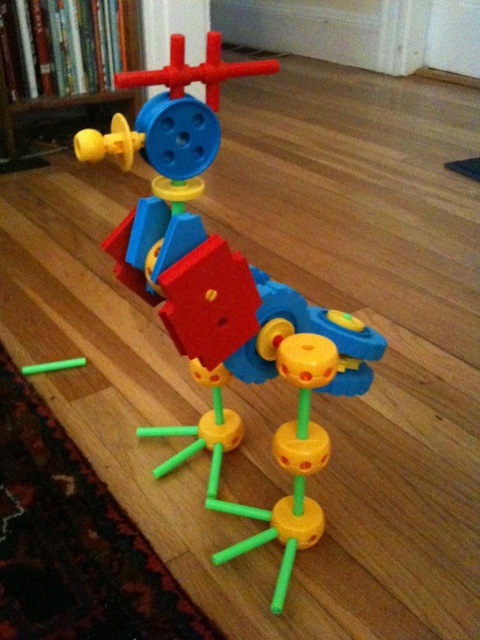
Question: Among these objects, which one is nearest to the camera?

Choices:
 (A) matte yellow plastic toy at upper left
 (B) matte plastic toy at center

Answer: (B)

Question: Observing the image, what is the correct spatial positioning of matte plastic toy at center in reference to matte yellow plastic toy at upper left?

Choices:
 (A) above
 (B) below

Answer: (B)

Question: Observing the image, what is the correct spatial positioning of matte plastic toy at center in reference to matte yellow plastic toy at upper left?

Choices:
 (A) right
 (B) left

Answer: (A)

Question: Does matte plastic toy at center appear over matte yellow plastic toy at upper left?

Choices:
 (A) no
 (B) yes

Answer: (A)

Question: Among these points, which one is nearest to the camera?

Choices:
 (A) (120, 100)
 (B) (302, 387)

Answer: (B)